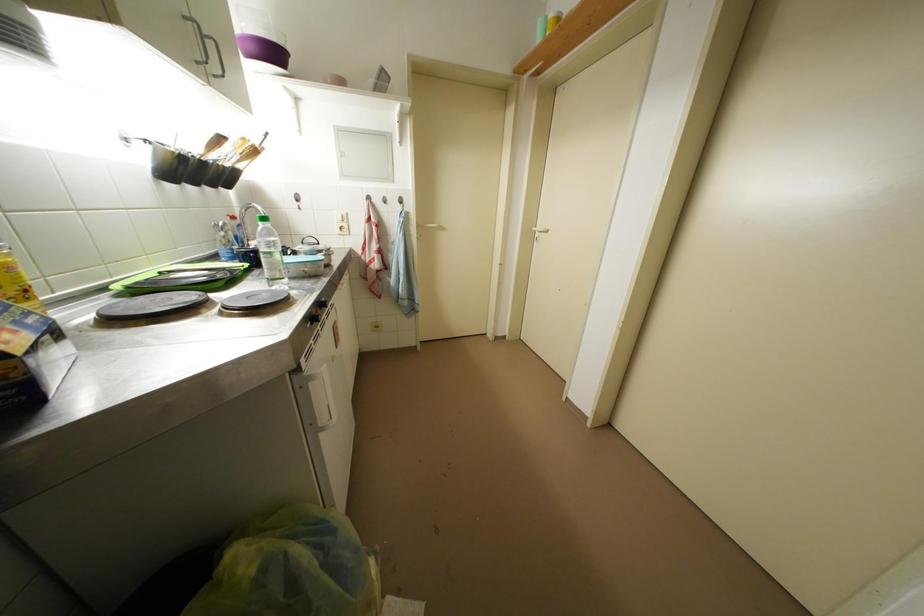
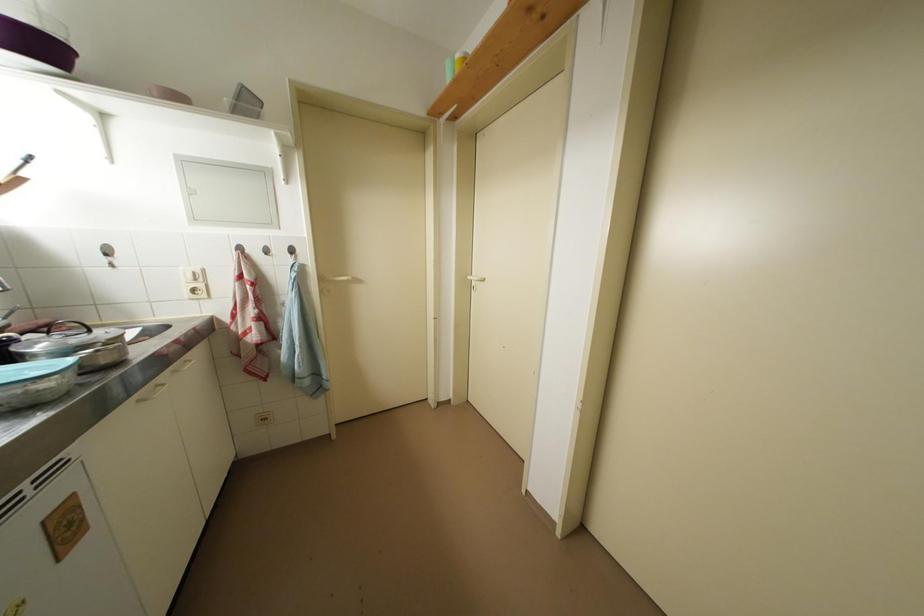
Find the pixel in the second image that matches (x=541, y=233) in the first image.

(476, 282)